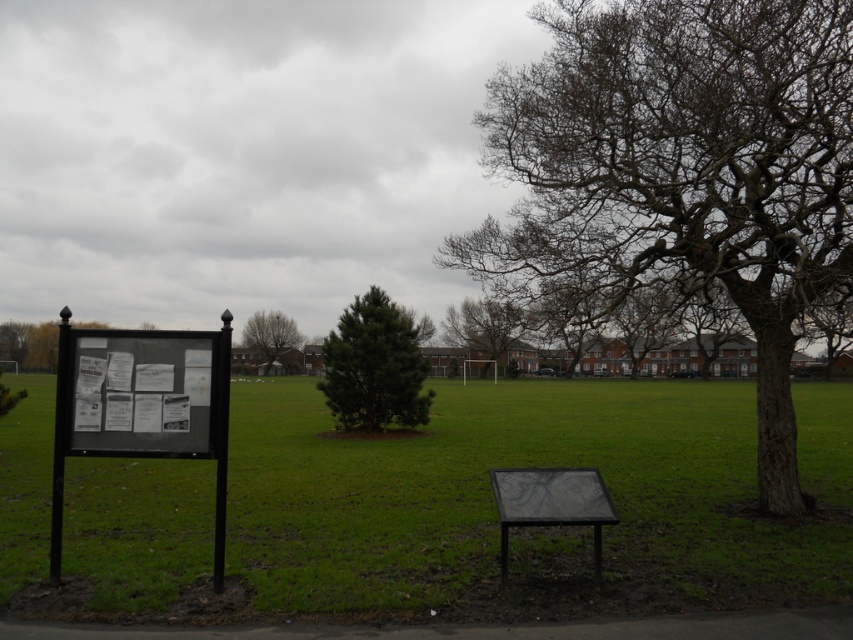
Question: Considering the real-world distances, which object is farthest from the brown textured tree at center?

Choices:
 (A) green leafy tree at center
 (B) black textured bench at center
 (C) green needle-like tree at center
 (D) bare wood tree at right

Answer: (A)

Question: Considering the relative positions of black matte signboard at left and green needle-like tree at center in the image provided, where is black matte signboard at left located with respect to green needle-like tree at center?

Choices:
 (A) left
 (B) right

Answer: (A)

Question: Considering the relative positions of black matte signboard at left and bare wood tree at right in the image provided, where is black matte signboard at left located with respect to bare wood tree at right?

Choices:
 (A) left
 (B) right

Answer: (A)

Question: Which point appears farthest from the camera in this image?

Choices:
 (A) (457, 573)
 (B) (264, 352)
 (C) (535, 509)

Answer: (B)

Question: Estimate the real-world distances between objects in this image. Which object is closer to the black textured bench at center?

Choices:
 (A) brown textured tree at center
 (B) black matte signboard at left

Answer: (A)

Question: Is brown textured tree at center thinner than green leafy tree at center?

Choices:
 (A) yes
 (B) no

Answer: (B)